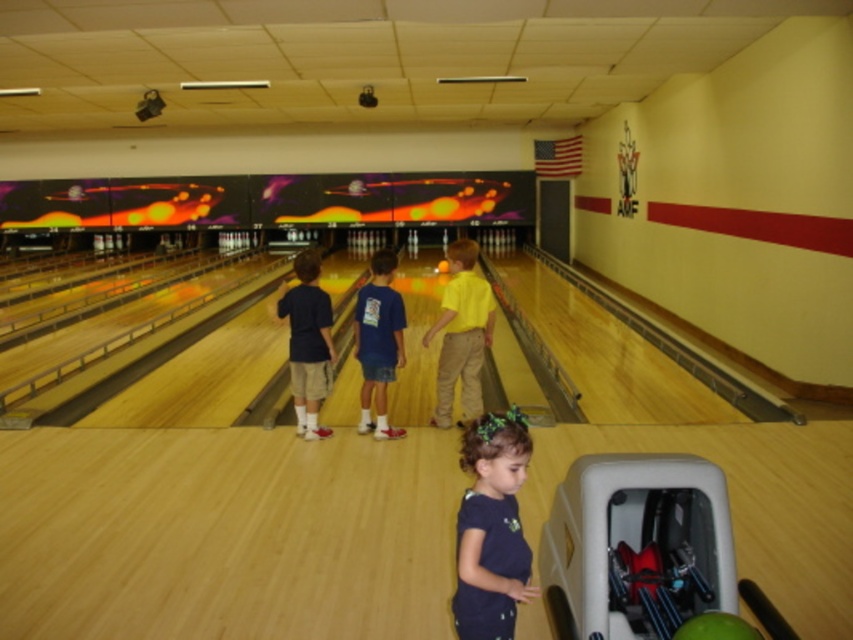
Based on the photo, is blue cotton shirt at center to the left of green matte bowling ball at lower center from the viewer's perspective?

Correct, you'll find blue cotton shirt at center to the left of green matte bowling ball at lower center.

Who is shorter, blue cotton shirt at center or green matte bowling ball at lower center?

With less height is green matte bowling ball at lower center.

Which is behind, point (358, 362) or point (691, 627)?

Point (358, 362)

Find the location of a particular element. This screenshot has width=853, height=640. blue cotton shirt at center is located at coordinates (378, 342).

Is dark blue t-shirt at center smaller than orange matte bowling ball at center?

No.

Is point (490, 566) closer to camera compared to point (440, 266)?

Yes, point (490, 566) is closer to viewer.

Identify the location of dark blue t-shirt at center. (491, 529).

Which is in front, point (315, 360) or point (437, 269)?

Point (315, 360) is more forward.

Between matte blue shirt at center and orange matte bowling ball at center, which one appears on the right side from the viewer's perspective?

Positioned to the right is orange matte bowling ball at center.

What do you see at coordinates (306, 342) in the screenshot?
I see `matte blue shirt at center` at bounding box center [306, 342].

Image resolution: width=853 pixels, height=640 pixels. I want to click on matte blue shirt at center, so click(306, 342).